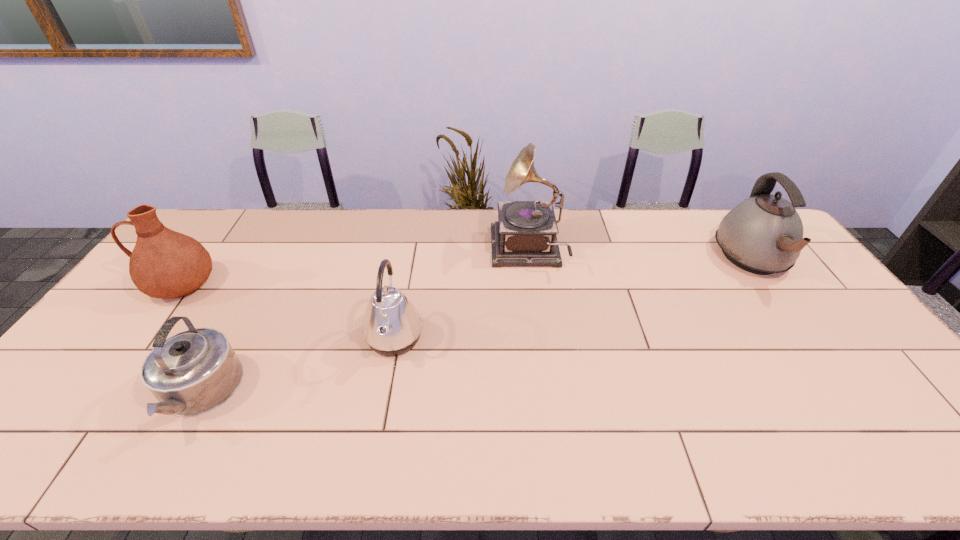
The image size is (960, 540). I want to click on free space at the near edge of the desktop, so click(x=733, y=445).

In order to click on free region at the left edge in this screenshot , I will do `click(122, 333)`.

At what (x,y) coordinates should I click in order to perform the action: click on free space between the leftmost kettle and the second kettle from left to right. Please return your answer as a coordinate pair (x, y). This screenshot has width=960, height=540. Looking at the image, I should click on (296, 366).

Locate an element on the screen. The height and width of the screenshot is (540, 960). vacant space that's between the third object from right to left and the rightmost object is located at coordinates (574, 299).

Locate an element on the screen. This screenshot has width=960, height=540. vacant point located between the pitcher and the third object from left to right is located at coordinates pos(287,312).

Identify the location of vacant space that's between the third object from right to left and the rightmost object. This screenshot has height=540, width=960. (574, 299).

Identify the location of free area in between the farthest kettle and the pitcher. The image size is (960, 540). point(467,272).

Identify the location of free area in between the record player and the leftmost object. (353, 268).

Image resolution: width=960 pixels, height=540 pixels. Identify the location of free space between the pitcher and the rightmost kettle. (467, 272).

Find the location of a particular element. vacant space that's between the third object from left to right and the fourth object from right to left is located at coordinates (296, 366).